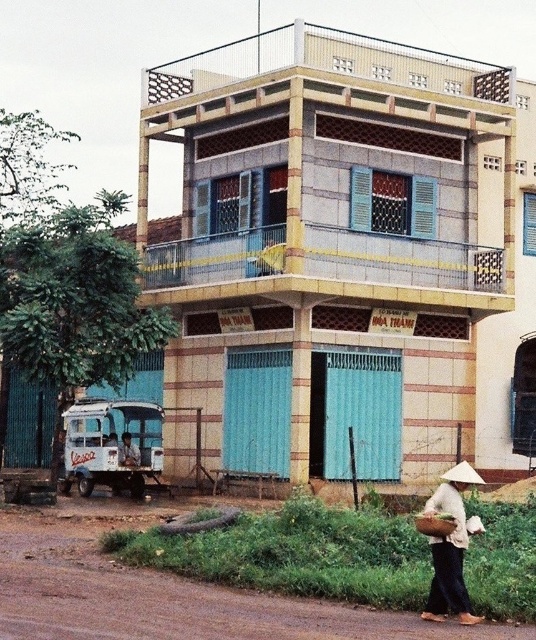
You are standing at the entrance of the building and want to place a package on the ground. The package is too heavy to lift high. You see the brown dirt track at lower left and the white woven basket at lower right. Which object can you place the package on without lifting it higher than the other?

The brown dirt track at lower left is positioned under the white woven basket at lower right, so you can place the package on the brown dirt track at lower left without needing to lift it higher than the white woven basket at lower right.